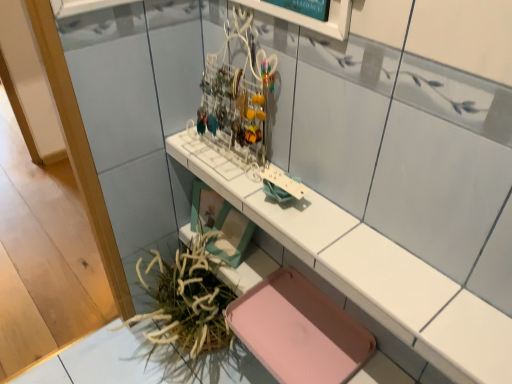
The height and width of the screenshot is (384, 512). In order to click on vacant region above white glossy counter at center (from a real-world perspective) in this screenshot , I will do `click(324, 228)`.